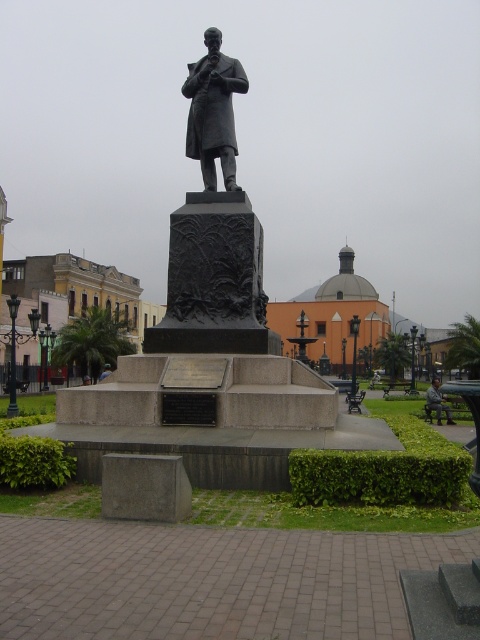
You are standing in the public square and want to take a photo of the statue. The camera you have can focus on objects up to 10 meters away. There is a specific point at coordinates point (236, 307) that you need to capture clearly. Is the statue within the camera range?

The distance of point (236, 307) from the viewer is 11.15 meters, which is beyond the camera range of 10 meters. Therefore, the statue will not be in focus.

You are standing in the public square and want to take a photo of the bronze statue at center. If you are positioned at point 0.175, 0.446, will you be able to capture the entire statue in your camera frame?

The bronze statue at center is located at point (214, 112), so if you are positioned exactly at that point, you would be standing right where the statue is, making it impossible to capture it in your photo.